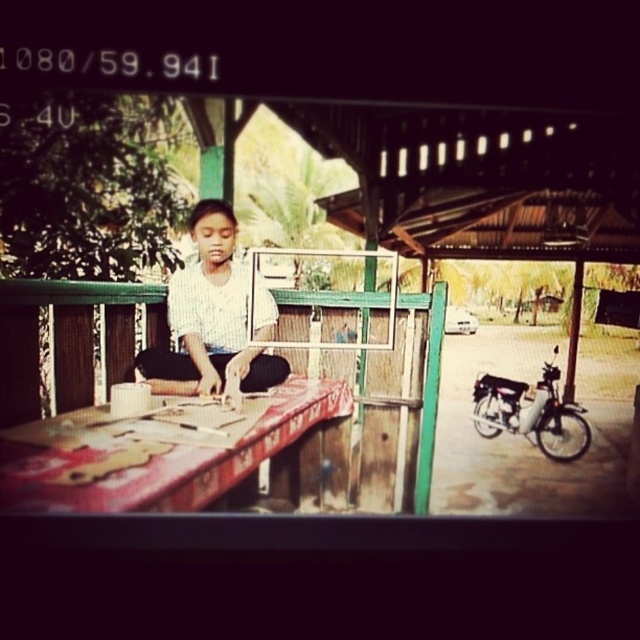
Question: Is wooden table at center to the left of white striped shirt at center from the viewer's perspective?

Choices:
 (A) yes
 (B) no

Answer: (A)

Question: Which object appears closest to the camera in this image?

Choices:
 (A) white striped shirt at center
 (B) wooden table at center

Answer: (B)

Question: Does wooden table at center have a larger size compared to white striped shirt at center?

Choices:
 (A) yes
 (B) no

Answer: (A)

Question: Which of the following is the closest to the observer?

Choices:
 (A) (216, 298)
 (B) (108, 426)

Answer: (B)

Question: Which of the following is the farthest from the observer?

Choices:
 (A) (209, 364)
 (B) (129, 426)

Answer: (A)

Question: Is wooden table at center to the left of white striped shirt at center from the viewer's perspective?

Choices:
 (A) no
 (B) yes

Answer: (B)